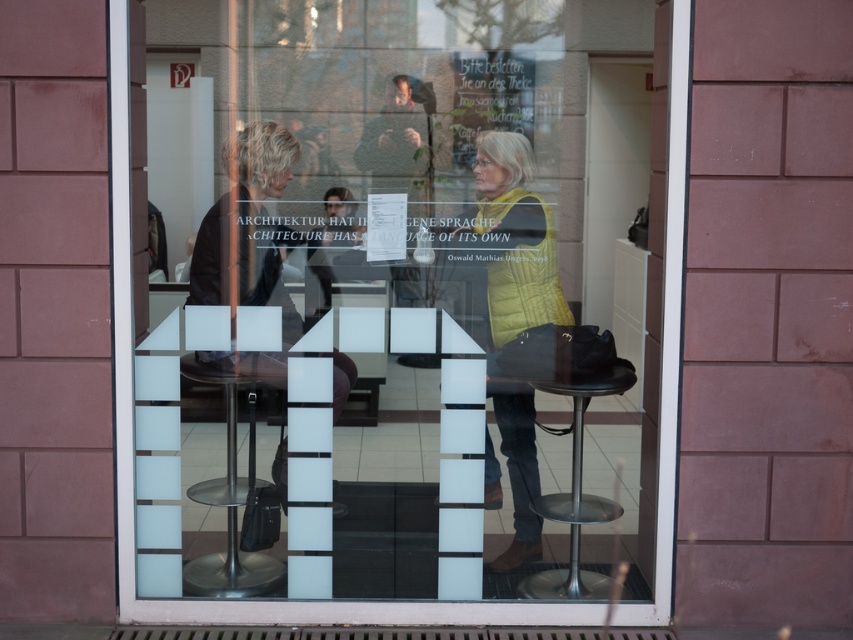
You are a delivery person who needs to place a package on the table between the two people in the image. The package must be placed exactly at the coordinates given for the yellow knitted sweater at center. What are the coordinates where you should place the package?

The coordinates for the yellow knitted sweater at center are (509, 241). Place the package at those coordinates.